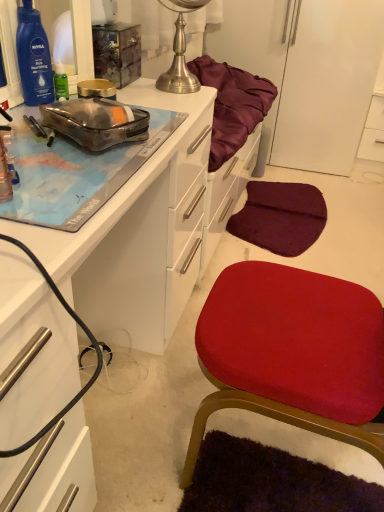
Question: Do you think brushed metal globe at upper center is within transparent plastic pouch at upper left, or outside of it?

Choices:
 (A) outside
 (B) inside

Answer: (A)

Question: From a real-world perspective, relative to transparent plastic pouch at upper left, is brushed metal globe at upper center vertically above or below?

Choices:
 (A) below
 (B) above

Answer: (B)

Question: Estimate the real-world distances between objects in this image. Which object is farther from the brushed metal globe at upper center?

Choices:
 (A) velvet red cushion at center
 (B) white glossy cabinet at upper right, the first cabinetry when ordered from top to bottom
 (C) matte white desk at upper left, which is the 2th cabinetry in top-to-bottom order
 (D) transparent plastic pouch at upper left

Answer: (A)

Question: Which object is positioned farthest from the transparent plastic pouch at upper left?

Choices:
 (A) white glossy cabinet at upper right, marked as the 1th cabinetry in a right-to-left arrangement
 (B) matte white desk at upper left, the 1th cabinetry when ordered from bottom to top
 (C) brushed metal globe at upper center
 (D) velvet red cushion at center

Answer: (A)